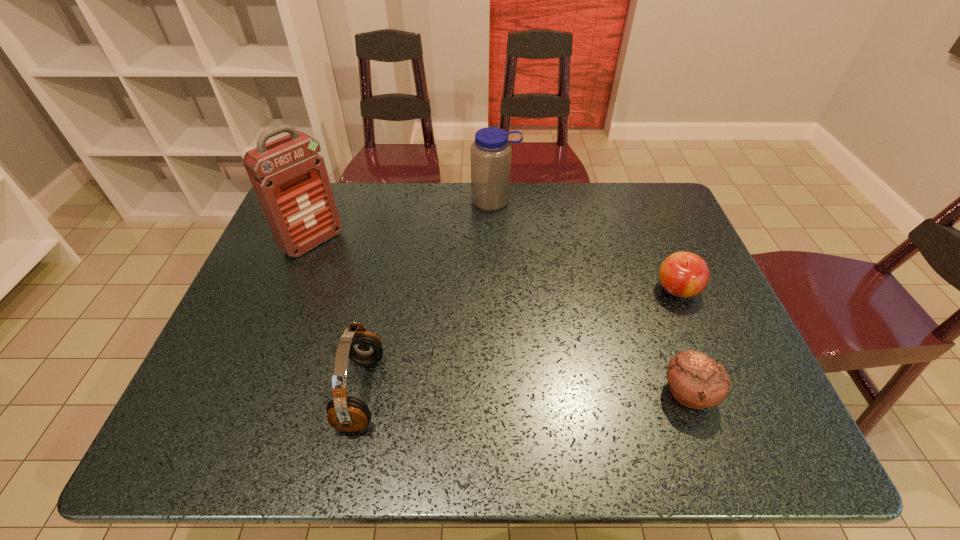
At what (x,y) coordinates should I click in order to perform the action: click on free space located 0.390m with a carrying loop on the side of the third object from left to right. Please return your answer as a coordinate pair (x, y). The image size is (960, 540). Looking at the image, I should click on (499, 307).

Find the location of `the first-aid kit situated at the far edge`. the first-aid kit situated at the far edge is located at coordinates (290, 179).

The height and width of the screenshot is (540, 960). In order to click on water bottle present at the far edge in this screenshot , I will do `click(491, 151)`.

Locate an element on the screen. This screenshot has width=960, height=540. headset present at the near edge is located at coordinates (345, 413).

Find the location of a particular element. This screenshot has width=960, height=540. muffin that is at the near edge is located at coordinates (696, 381).

Where is `object positioned at the left edge`? This screenshot has height=540, width=960. object positioned at the left edge is located at coordinates (290, 179).

Where is `muffin that is at the right edge`? The height and width of the screenshot is (540, 960). muffin that is at the right edge is located at coordinates (696, 381).

In order to click on apple that is at the right edge in this screenshot , I will do `click(682, 274)`.

The width and height of the screenshot is (960, 540). What are the coordinates of `object at the far left corner` in the screenshot? It's located at (290, 179).

Identify the location of object that is at the near right corner. (696, 381).